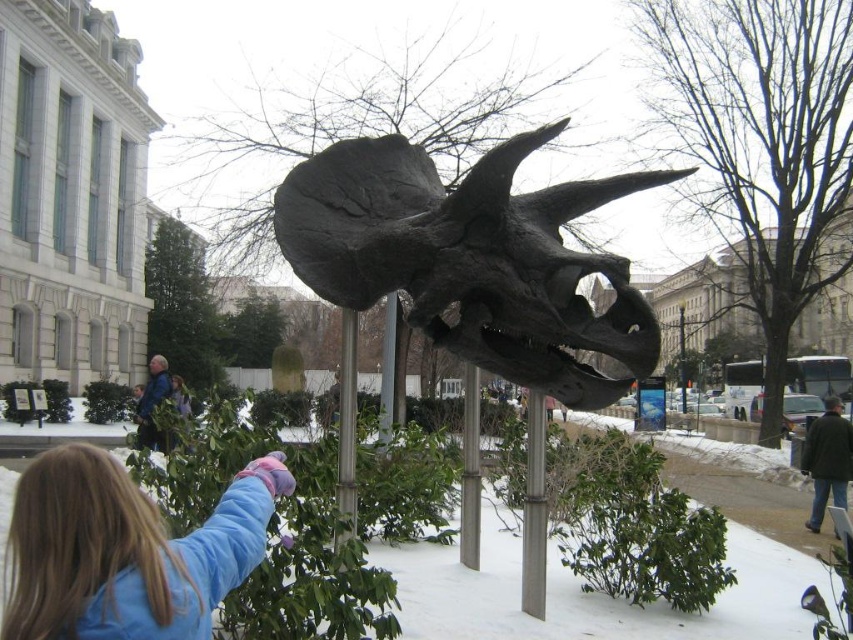
You are a visitor standing in the snow near the blue fleece jacket at lower left and the silver metallic pole at center. Which object is taller?

The silver metallic pole at center is taller than the blue fleece jacket at lower left.

You are standing in the museum courtyard and want to take a photo of the triceratops skull. The metallic gray pole at center might block your view. Where is the pole positioned relative to the skull?

The metallic gray pole at center is located at point (534, 509), which means it is positioned to the right and slightly below the center of the image, potentially blocking the view of the triceratops skull if you are standing in that area.

You are standing in the museum courtyard looking at the triceratops skull. There are two points marked in the image. The first point is at coordinate point (119, 536) and the second point is at coordinate point (473, 529). Which point is closer to you?

Point (119, 536) is closer to you because it is in front of point (473, 529).